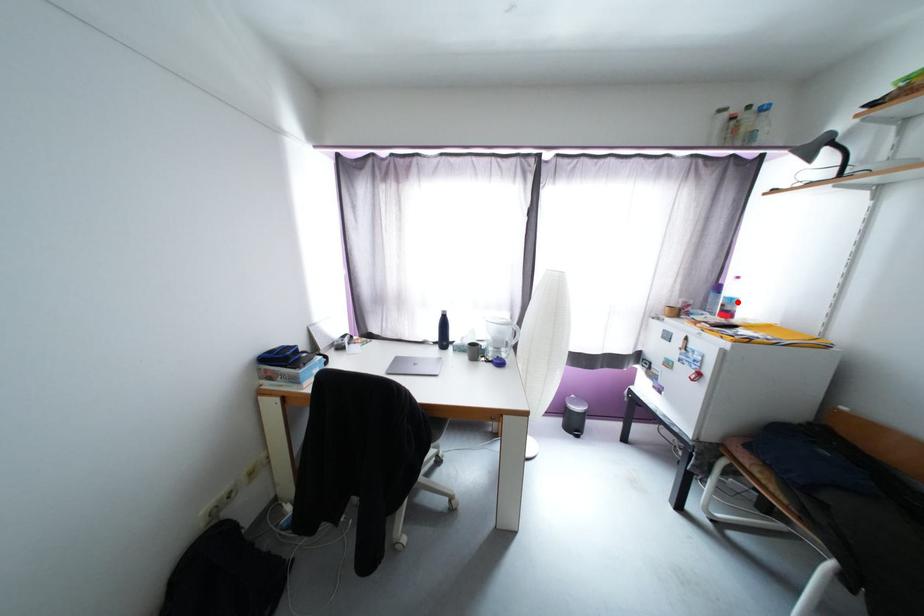
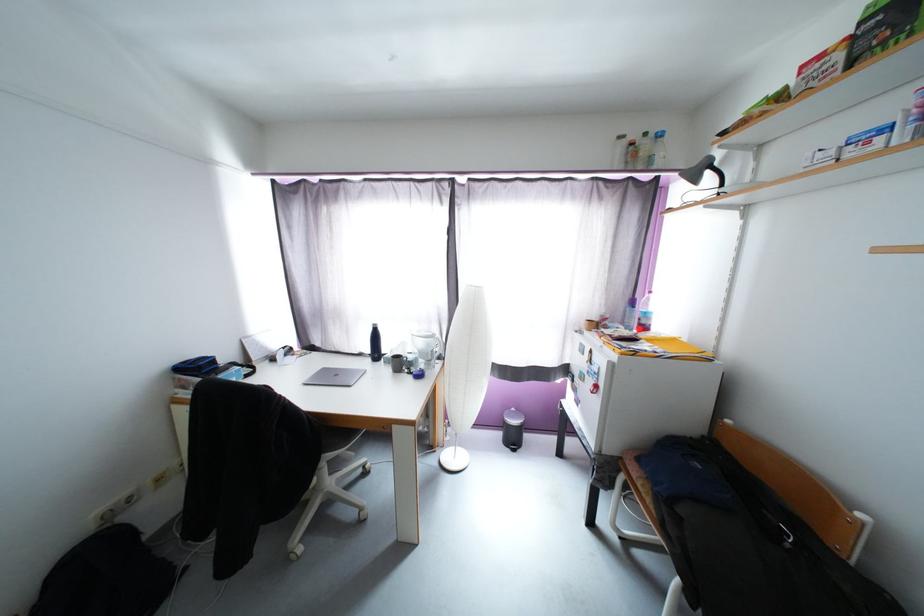
Find the pixel in the second image that matches the highlighted location in the first image.

(651, 315)